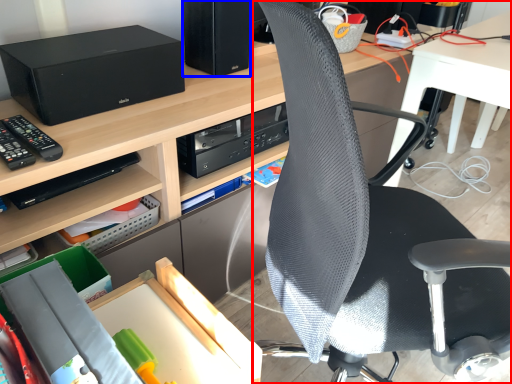
Question: Which object is further to the camera taking this photo, chair (highlighted by a red box) or computer tower (highlighted by a blue box)?

Choices:
 (A) chair
 (B) computer tower

Answer: (B)